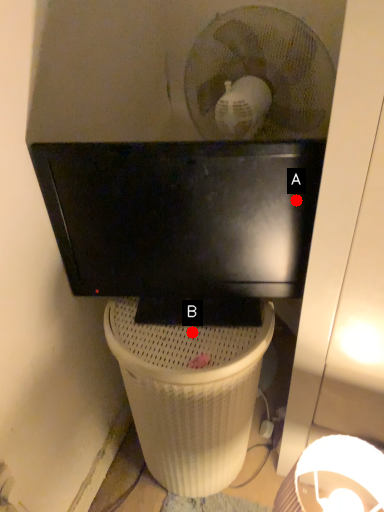
Question: Two points are circled on the image, labeled by A and B beside each circle. Among these points, which one is farthest from the camera?

Choices:
 (A) A is further
 (B) B is further

Answer: (B)